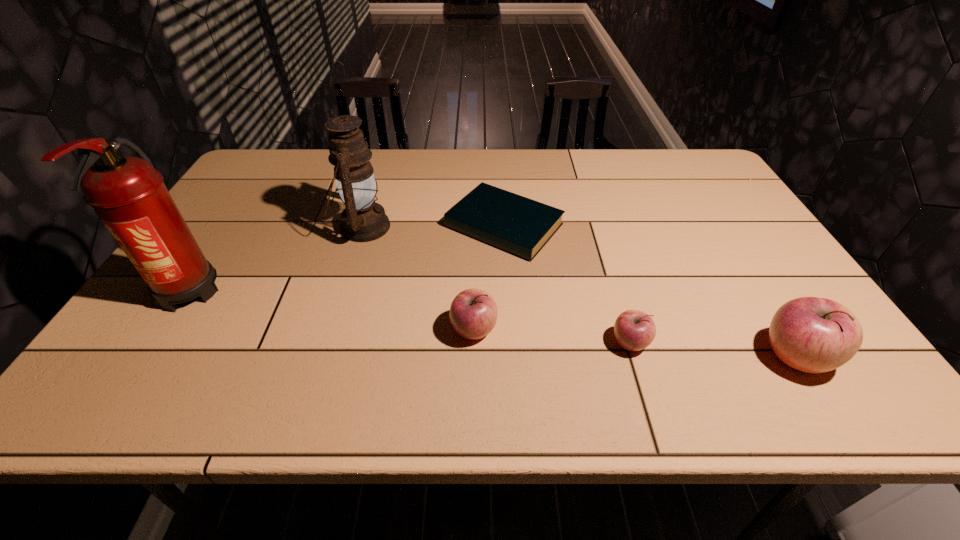
You are a GUI agent. You are given a task and a screenshot of the screen. Output one action in this format:
    pyautogui.click(x=<x>, y=<y>)
    Task: Click on the second object from left to right
    
    Given the screenshot: What is the action you would take?
    pyautogui.click(x=363, y=220)

Image resolution: width=960 pixels, height=540 pixels. Find the location of `vacant space positioned 0.190m on the right of the fourth tallest object`. vacant space positioned 0.190m on the right of the fourth tallest object is located at coordinates (582, 330).

Locate an element on the screen. free space located 0.110m on the back of the second apple from right to left is located at coordinates (614, 293).

The height and width of the screenshot is (540, 960). I want to click on vacant space located on the left of the rightmost object, so click(x=645, y=357).

This screenshot has height=540, width=960. I want to click on vacant position located 0.210m on the front of the book, so click(511, 325).

In order to click on free region located 0.070m on the front-facing side of the tallest object in this screenshot , I will do `click(150, 349)`.

Identify the location of blank area located 0.150m on the right of the fifth object from right to left. The image size is (960, 540). (443, 227).

Locate an element on the screen. The image size is (960, 540). object at the left edge is located at coordinates (128, 194).

Find the location of a particular element. The image size is (960, 540). object located in the right edge section of the desktop is located at coordinates (814, 335).

Identify the location of object that is at the near right corner. This screenshot has height=540, width=960. (814, 335).